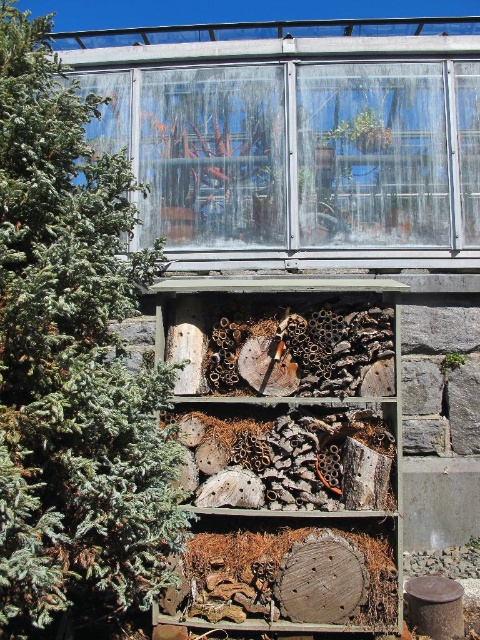
Is green textured pine tree at left above wooden beehive at center?

Indeed, green textured pine tree at left is positioned over wooden beehive at center.

Looking at this image, is green textured pine tree at left thinner than wooden beehive at center?

Correct, green textured pine tree at left's width is less than wooden beehive at center's.

Which is behind, point (22, 138) or point (211, 593)?

The point (211, 593) is more distant.

Image resolution: width=480 pixels, height=640 pixels. In order to click on green textured pine tree at left in this screenshot , I will do `click(72, 362)`.